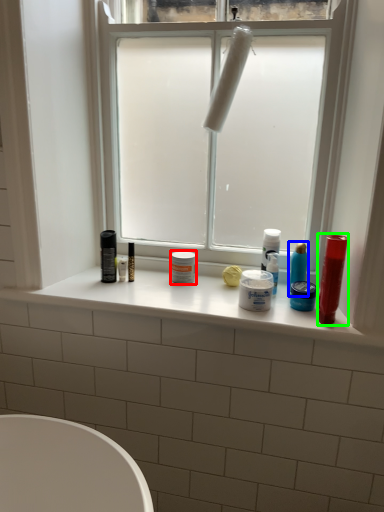
Question: Which is nearer to the toiletry (highlighted by a red box)? toiletry (highlighted by a blue box) or lip balm (highlighted by a green box).

Choices:
 (A) toiletry
 (B) lip balm

Answer: (A)